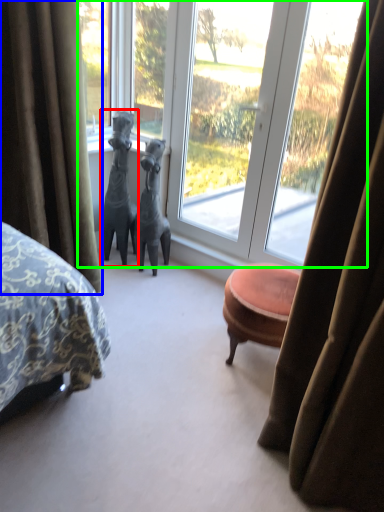
Question: Which object is the closest to the animal (highlighted by a red box)? Choose among these: curtain (highlighted by a blue box) or window (highlighted by a green box).

Choices:
 (A) curtain
 (B) window

Answer: (B)